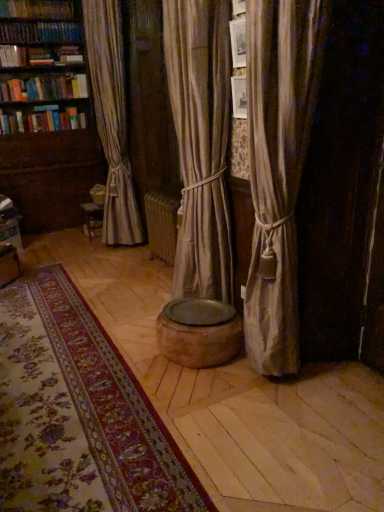
Find the location of a particular element. This screenshot has width=384, height=512. free space above floral carpet at center (from a real-world perspective) is located at coordinates (47, 355).